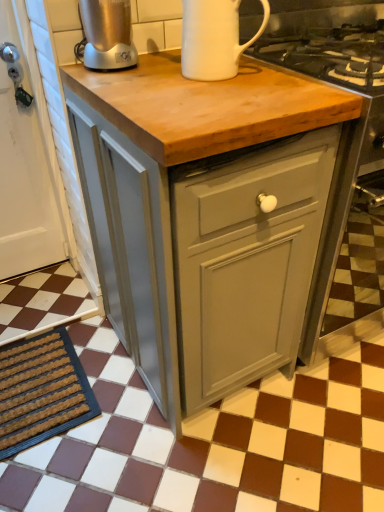
Question: From a real-world perspective, is brown textured mat at lower left physically above brown checkered tile at center?

Choices:
 (A) yes
 (B) no

Answer: (A)

Question: From the image's perspective, is brown textured mat at lower left located above brown checkered tile at center?

Choices:
 (A) no
 (B) yes

Answer: (A)

Question: From a real-world perspective, is brown textured mat at lower left beneath brown checkered tile at center?

Choices:
 (A) yes
 (B) no

Answer: (B)

Question: From the image's perspective, is brown textured mat at lower left located beneath brown checkered tile at center?

Choices:
 (A) no
 (B) yes

Answer: (B)

Question: Does brown textured mat at lower left have a greater height compared to brown checkered tile at center?

Choices:
 (A) no
 (B) yes

Answer: (A)

Question: Is brown textured mat at lower left outside of brown checkered tile at center?

Choices:
 (A) yes
 (B) no

Answer: (A)

Question: Does matte gray cabinet at center turn towards matte gray cabinet at center?

Choices:
 (A) no
 (B) yes

Answer: (A)

Question: Can you confirm if matte gray cabinet at center is smaller than matte gray cabinet at center?

Choices:
 (A) no
 (B) yes

Answer: (B)

Question: Is matte gray cabinet at center turned away from matte gray cabinet at center?

Choices:
 (A) no
 (B) yes

Answer: (A)

Question: From a real-world perspective, does matte gray cabinet at center sit lower than matte gray cabinet at center?

Choices:
 (A) no
 (B) yes

Answer: (A)

Question: Does matte gray cabinet at center have a lesser width compared to matte gray cabinet at center?

Choices:
 (A) yes
 (B) no

Answer: (A)

Question: From the image's perspective, is matte gray cabinet at center on matte gray cabinet at center?

Choices:
 (A) yes
 (B) no

Answer: (B)

Question: Considering the relative positions of white ceramic mug at upper center, the 2th kitchen appliance when ordered from left to right, and matte gray cabinet at center in the image provided, is white ceramic mug at upper center, the 2th kitchen appliance when ordered from left to right, to the left of matte gray cabinet at center from the viewer's perspective?

Choices:
 (A) yes
 (B) no

Answer: (A)